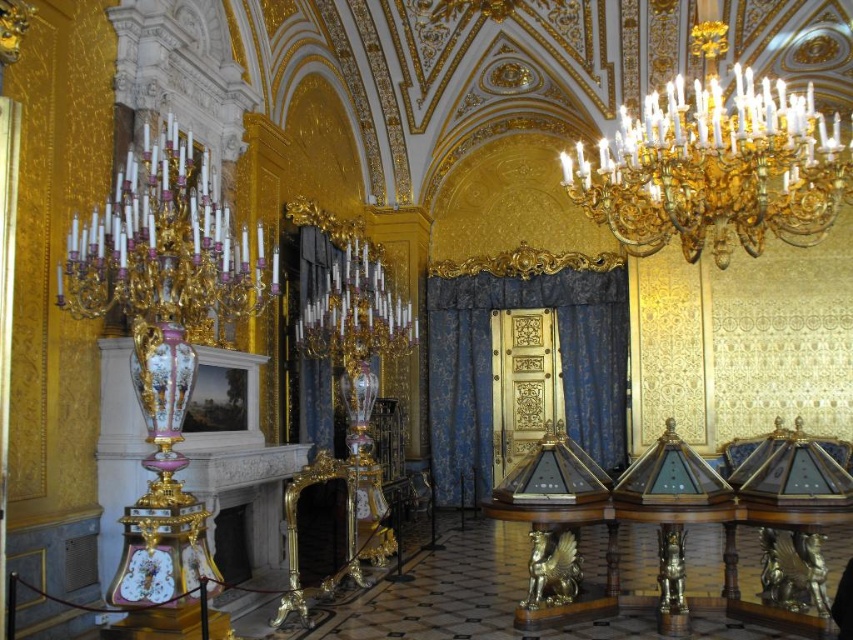
Which is below, gold/gilded metal chandelier at upper right or gold/gilded/candleholder at upper left?

Positioned lower is gold/gilded/candleholder at upper left.

Which is above, gold/gilded metal chandelier at upper right or gold/gilded/candleholder at upper left?

gold/gilded metal chandelier at upper right is above.

Which is in front, point (635, 228) or point (224, 244)?

Point (224, 244)

Locate an element on the screen. The height and width of the screenshot is (640, 853). gold/gilded metal chandelier at upper right is located at coordinates (715, 163).

What do you see at coordinates (715, 163) in the screenshot? Image resolution: width=853 pixels, height=640 pixels. I see `gold/gilded metal chandelier at upper right` at bounding box center [715, 163].

In the scene shown: Who is taller, gold/gilded metal chandelier at upper right or black velvet curtain at center?

Standing taller between the two is gold/gilded metal chandelier at upper right.

The height and width of the screenshot is (640, 853). I want to click on gold/gilded metal chandelier at upper right, so click(715, 163).

Can you confirm if gold/gilded metal chandelier at upper right is taller than blue velvet curtain at center?

No, gold/gilded metal chandelier at upper right is not taller than blue velvet curtain at center.

Where is `gold/gilded metal chandelier at upper right`? gold/gilded metal chandelier at upper right is located at coordinates coord(715,163).